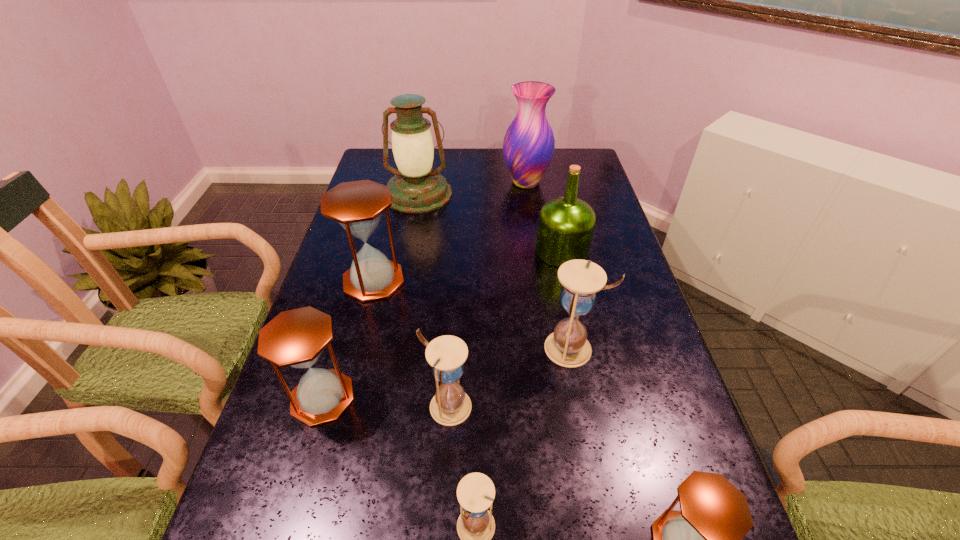
The height and width of the screenshot is (540, 960). Identify the location of vacant space located with the light compartment facing forward on the lantern. (413, 224).

At what (x,y) coordinates should I click in order to perform the action: click on free region located 0.050m on the left of the olive oil. Please return your answer as a coordinate pair (x, y). This screenshot has height=540, width=960. Looking at the image, I should click on (518, 251).

I want to click on vacant area situated 0.270m on the right of the farthest brown hourglass, so click(x=501, y=281).

Locate an element on the screen. This screenshot has width=960, height=540. free space located 0.240m on the front of the rightmost white hourglass is located at coordinates (595, 472).

The width and height of the screenshot is (960, 540). I want to click on vacant space located 0.130m on the front of the second smallest brown hourglass, so click(295, 493).

The image size is (960, 540). Find the location of `vacant space located 0.140m on the right of the second biggest white hourglass`. vacant space located 0.140m on the right of the second biggest white hourglass is located at coordinates (537, 407).

You are a GUI agent. You are given a task and a screenshot of the screen. Output one action in this format:
    pyautogui.click(x=<x>, y=<y>)
    Task: Click on the vase at the far edge
    
    Given the screenshot: What is the action you would take?
    [529, 144]

The width and height of the screenshot is (960, 540). In order to click on lantern that is positioned at the far edge in this screenshot , I will do `click(416, 188)`.

Where is `lantern positioned at the left edge`? lantern positioned at the left edge is located at coordinates (416, 188).

Locate an element on the screen. olive oil positioned at the right edge is located at coordinates (566, 224).